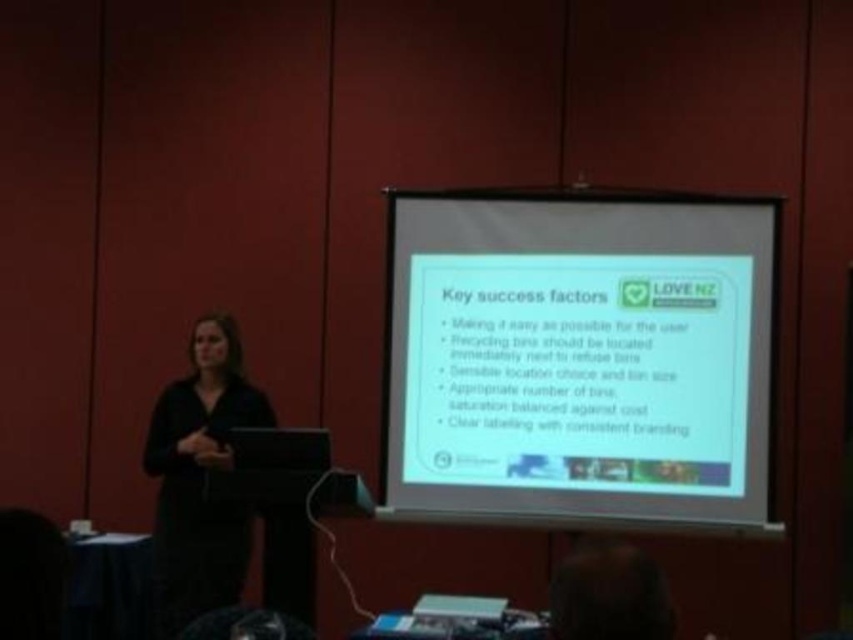
In the scene shown: You are organizing a presentation and need to place a decorative item on the podium. The podium has a white paper at center and a black matte dress at left. Which item is wider so that it can cover more space on the podium?

The white paper at center might be wider than black matte dress at left, so it can cover more space on the podium.

Based on the photo, you are an event planner organizing a presentation. You need to ensure that the white paper at center and the black matte dress at left are both visible to the audience. Which object will appear shorter on the projection screen?

The white paper at center has a lesser height compared to the black matte dress at left, so it will appear shorter on the projection screen.